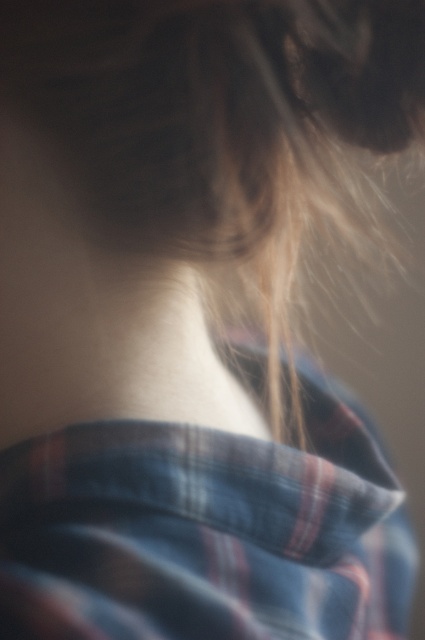
Question: Does plaid cotton shirt at center appear on the left side of skinny white neck at center?

Choices:
 (A) no
 (B) yes

Answer: (A)

Question: Is plaid cotton shirt at center to the right of skinny white neck at center from the viewer's perspective?

Choices:
 (A) no
 (B) yes

Answer: (B)

Question: Which point is closer to the camera?

Choices:
 (A) plaid cotton shirt at center
 (B) skinny white neck at center

Answer: (A)

Question: Can you confirm if plaid cotton shirt at center is positioned to the left of skinny white neck at center?

Choices:
 (A) yes
 (B) no

Answer: (B)